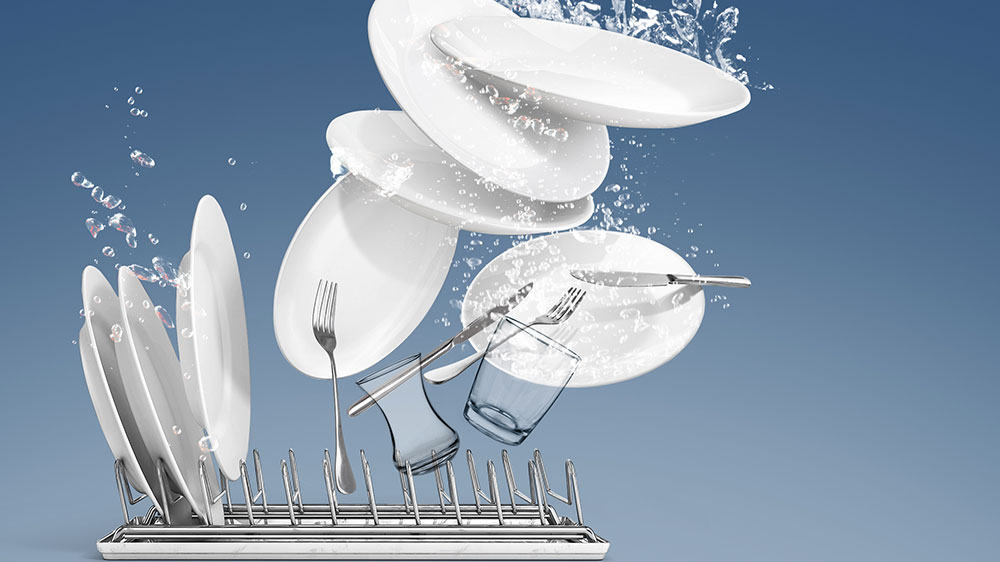
Where is `silverware`? The height and width of the screenshot is (562, 1000). silverware is located at coordinates (325, 337), (480, 330), (561, 315), (630, 279).